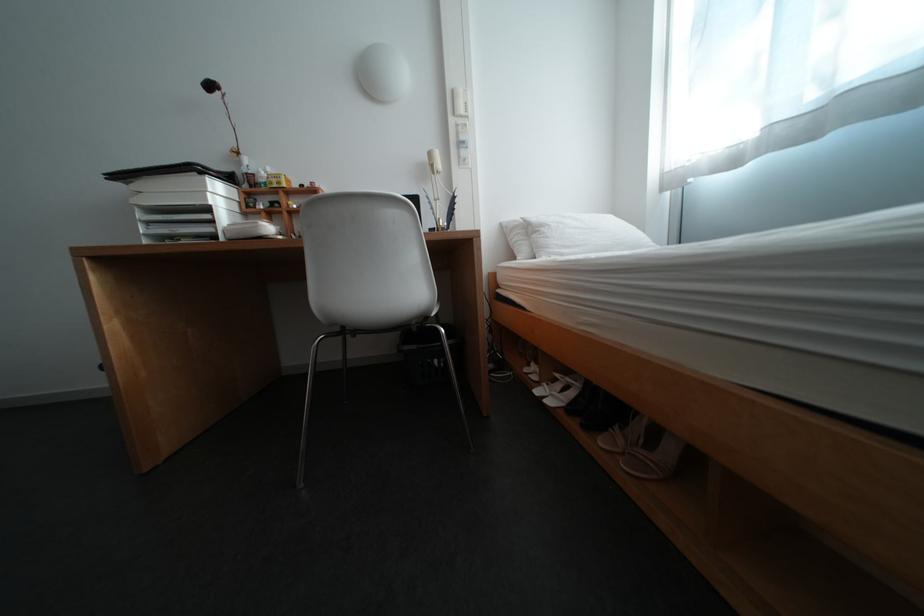
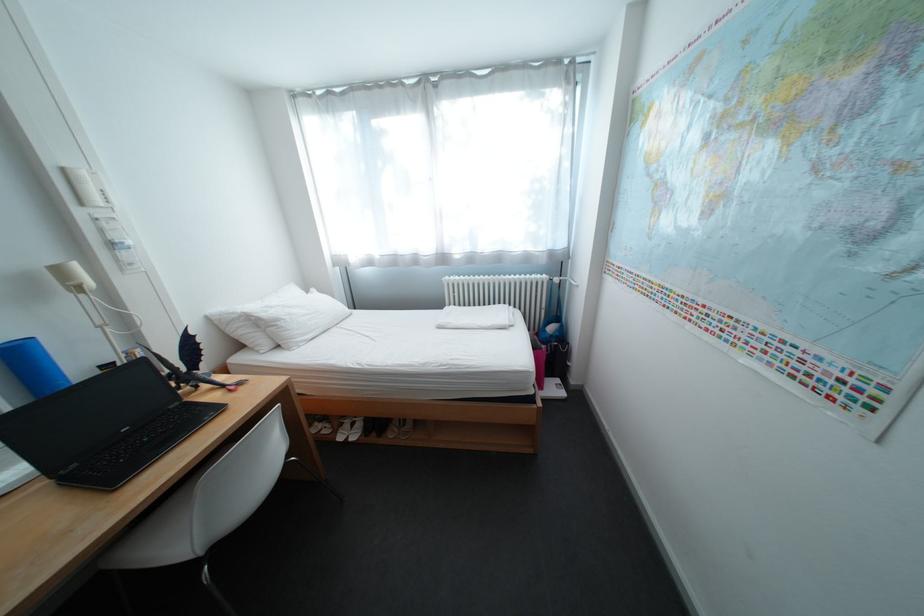
Locate, in the second image, the point that corresponds to the point at 555,228 in the first image.

(292, 322)